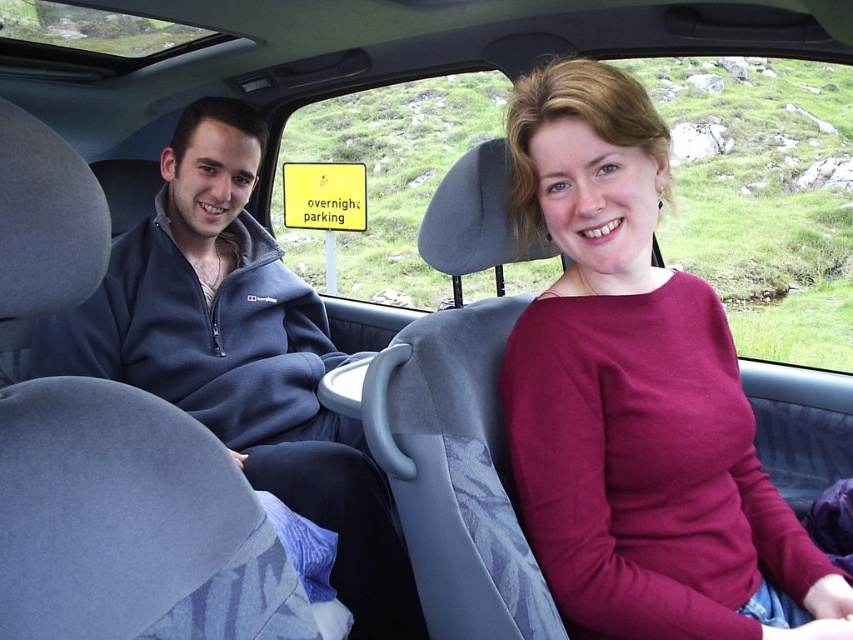
You are a passenger in the vehicle and want to reach the overnight parking sign outside. You see two points marked on the window at point (x=628, y=497) and point (x=341, y=492). Which point is closer to the sign?

Point (x=628, y=497) is in front of point (x=341, y=492), so the sign is closer to point (x=628, y=497).

You are designing a seating arrangement for a car ride and need to place two passengers. You have a maroon sweater at center and a dark blue fleece at left. Which passenger should sit where to ensure both can comfortably wear their jackets without the sleeves getting tangled?

The passenger wearing the maroon sweater at center should sit where there is more space since the maroon sweater at center has a lesser width compared to the dark blue fleece at left, allowing both to wear their jackets comfortably without sleeve tangling.

You are standing outside the vehicle and want to hand a small gift to the person wearing the maroon sweater at center. Can you reach them without entering the vehicle?

The maroon sweater at center and viewer are 1.06 meters apart from each other. Since the distance is about 1 meter, you can likely reach the person wearing the maroon sweater at center without entering the vehicle if your arm can extend that far.